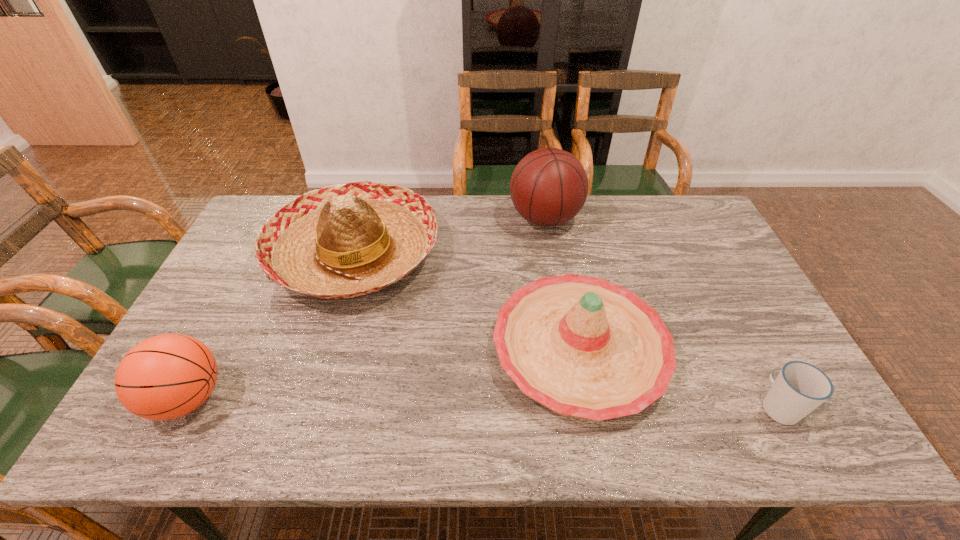
At what (x,y) coordinates should I click in order to perform the action: click on free space located 0.370m on the back of the right sombrero. Please return your answer as a coordinate pair (x, y). Looking at the image, I should click on [x=553, y=212].

Where is `free space located on the right of the nearer basketball`? free space located on the right of the nearer basketball is located at coordinates (367, 398).

The width and height of the screenshot is (960, 540). Identify the location of vacant region located 0.310m with a handle on the side of the cup. (718, 292).

What are the coordinates of `vacant point located 0.090m with a handle on the side of the cup` in the screenshot? It's located at (751, 354).

Locate an element on the screen. free location located 0.170m with a handle on the side of the cup is located at coordinates (738, 330).

Where is `basketball at the far edge`? The image size is (960, 540). basketball at the far edge is located at coordinates (549, 186).

Locate an element on the screen. Image resolution: width=960 pixels, height=540 pixels. sombrero that is at the far edge is located at coordinates (342, 241).

The width and height of the screenshot is (960, 540). I want to click on sombrero present at the near edge, so click(x=584, y=347).

This screenshot has width=960, height=540. What are the coordinates of `basketball positioned at the near edge` in the screenshot? It's located at (167, 376).

The image size is (960, 540). I want to click on cup at the near edge, so click(800, 387).